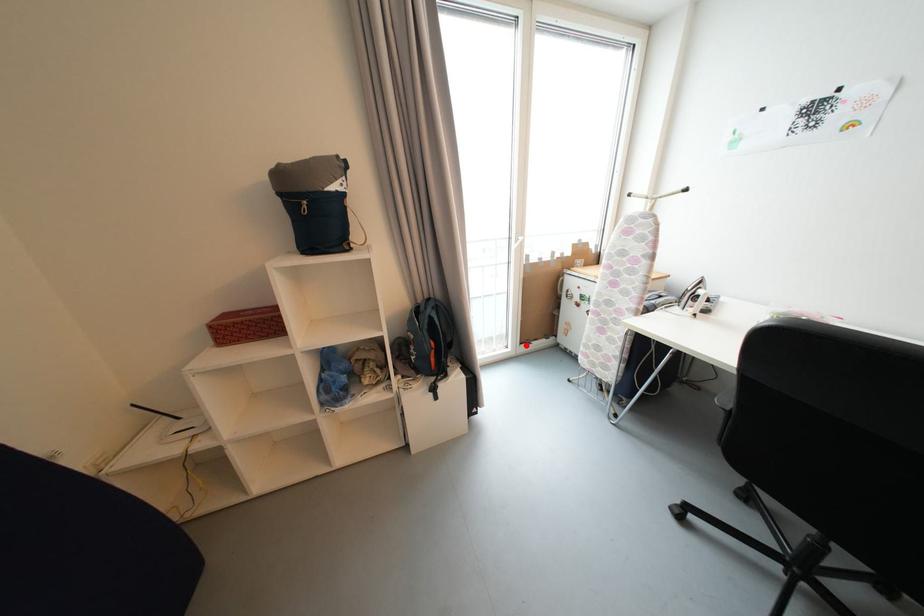
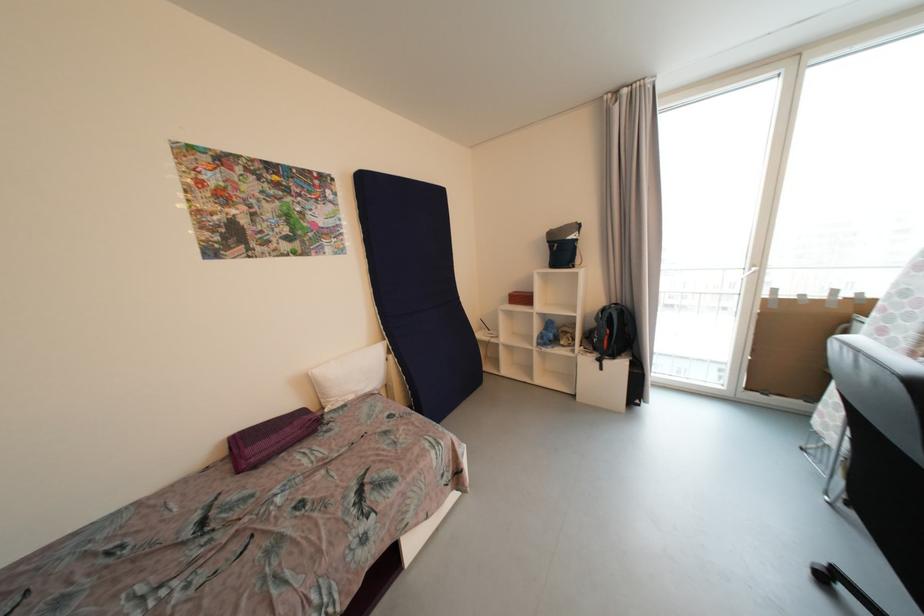
The point at the highlighted location is marked in the first image. Where is the corresponding point in the second image?

(752, 390)